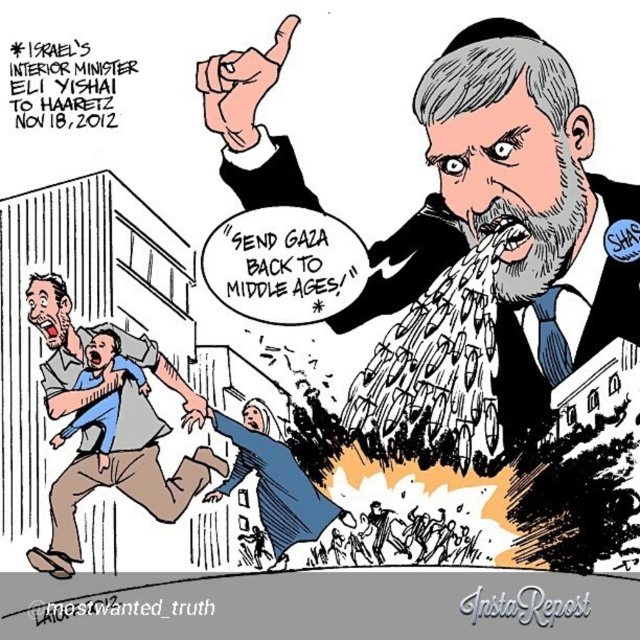
In the political cartoon, you notice the gray textured beard at center and the blue cotton shirt at lower left. Which object is closer to the viewer?

The gray textured beard at center is closer to the viewer than the blue cotton shirt at lower left.

In the political cartoon, the central figure, Israel Interior Minister Eli Yishai, is pointing upwards with his right hand. The point where his finger is pointing is located at coordinates point (248, 157). If the distance between his hand and the point is 5.13 meters, can a 5.5 meter long measuring tape reach from his hand to the point?

A: The distance between the hand and the point (248, 157) is 5.13 meters. Since the measuring tape is 5.5 meters long, which is longer than the distance, the measuring tape can reach from the hand to the point.

In the political cartoon, you see the gray textured beard at center and the blue cotton shirt at lower left. Which object is located to the right of the other?

The gray textured beard at center is positioned on the right side of blue cotton shirt at lower left.